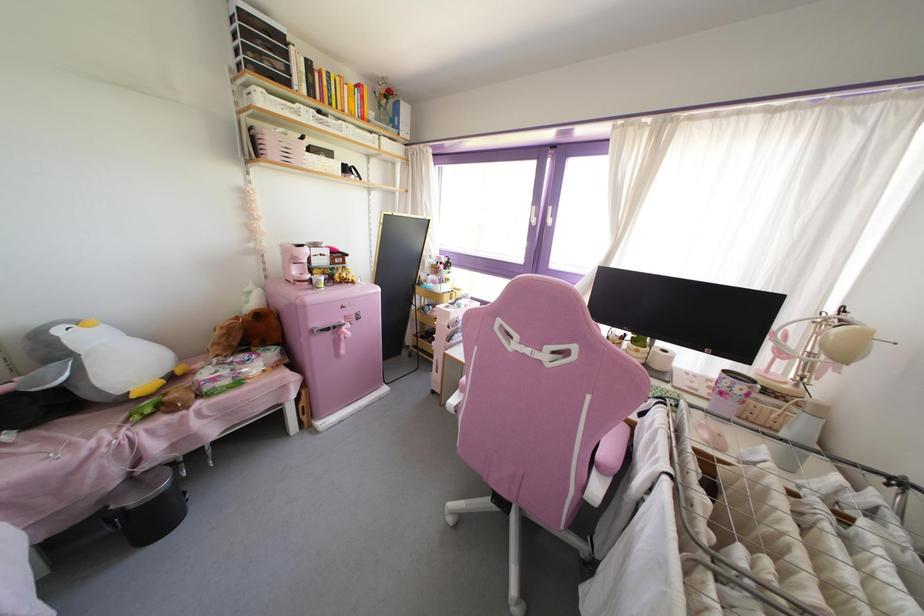
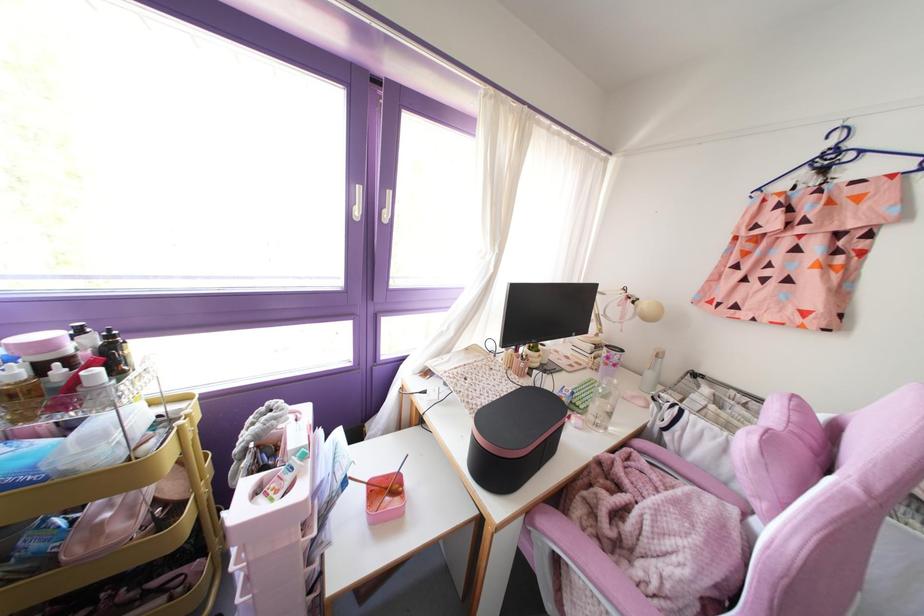
Find the pixel in the second image that matches the point at 721,392 in the first image.

(614, 365)